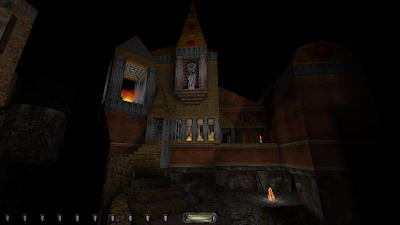
Locate an element on the screen. staircases is located at coordinates (157, 187), (150, 150).